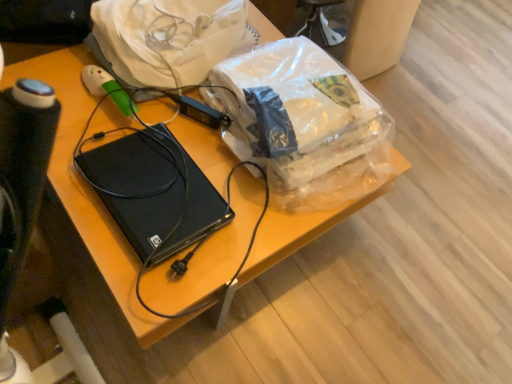
What are the coordinates of `free space to the back side of black plastic computer at center` in the screenshot? It's located at (183, 127).